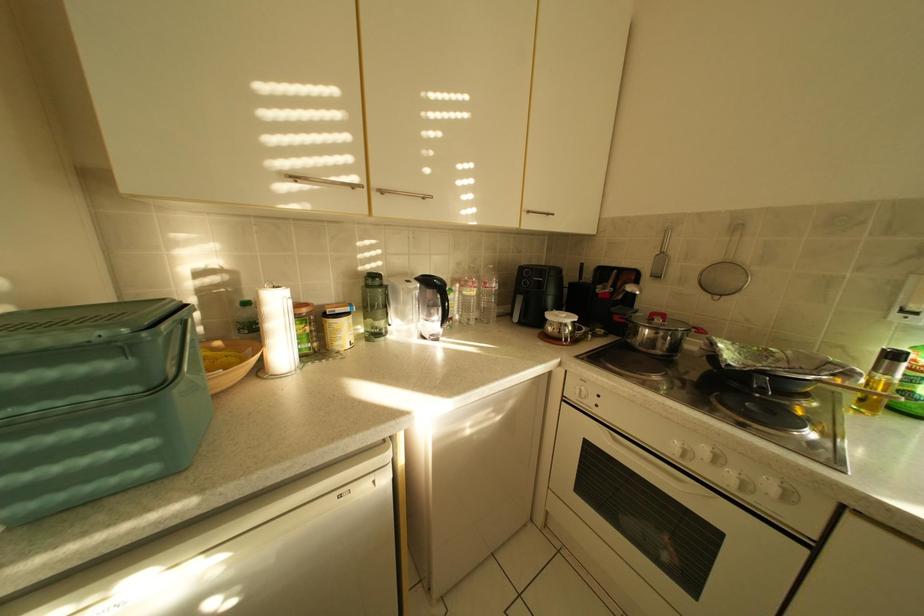
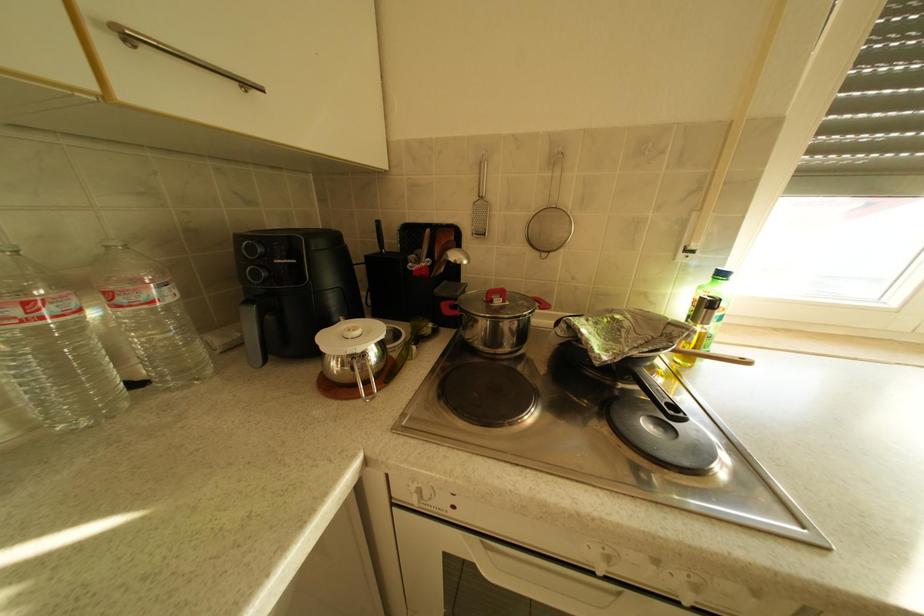
Question: The camera is either moving clockwise (left) or counter-clockwise (right) around the object. The first image is from the beginning of the video and the second image is from the end. Is the camera moving left or right when shooting the video?

Choices:
 (A) Left
 (B) Right

Answer: (A)